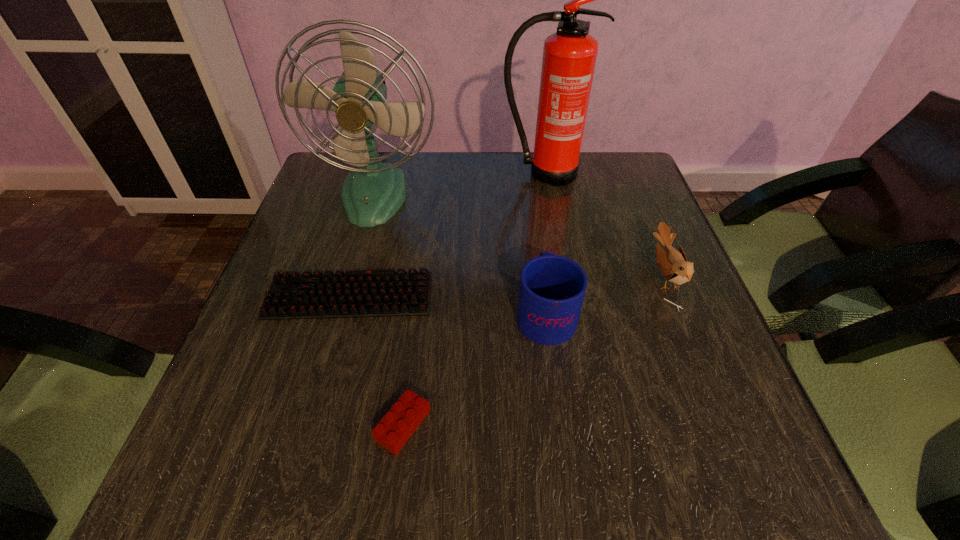
Find the location of a particular element. This screenshot has width=960, height=540. fire extinguisher is located at coordinates (569, 56).

I want to click on fan, so 371,194.

Where is `the fourth shortest object`? the fourth shortest object is located at coordinates (552, 288).

Identify the location of the fourth tallest object. (672, 264).

At what (x,y) coordinates should I click in order to perform the action: click on the rightmost object. Please return your answer as a coordinate pair (x, y). Looking at the image, I should click on coord(672,264).

Locate an element on the screen. This screenshot has height=540, width=960. the nearest object is located at coordinates (396, 427).

Image resolution: width=960 pixels, height=540 pixels. I want to click on the fifth tallest object, so click(396, 427).

The image size is (960, 540). I want to click on the shortest object, so click(x=356, y=293).

Where is `free point located 0.330m at the nozzle of the fire extinguisher`? free point located 0.330m at the nozzle of the fire extinguisher is located at coordinates (561, 275).

Locate an element on the screen. vacant space located in front of the fan, directing airflow is located at coordinates (343, 311).